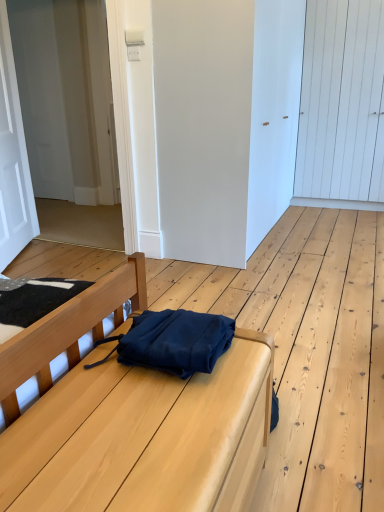
Image resolution: width=384 pixels, height=512 pixels. What are the coordinates of `free point above navy blue fabric at center (from a real-world perspective)` in the screenshot? It's located at (125, 426).